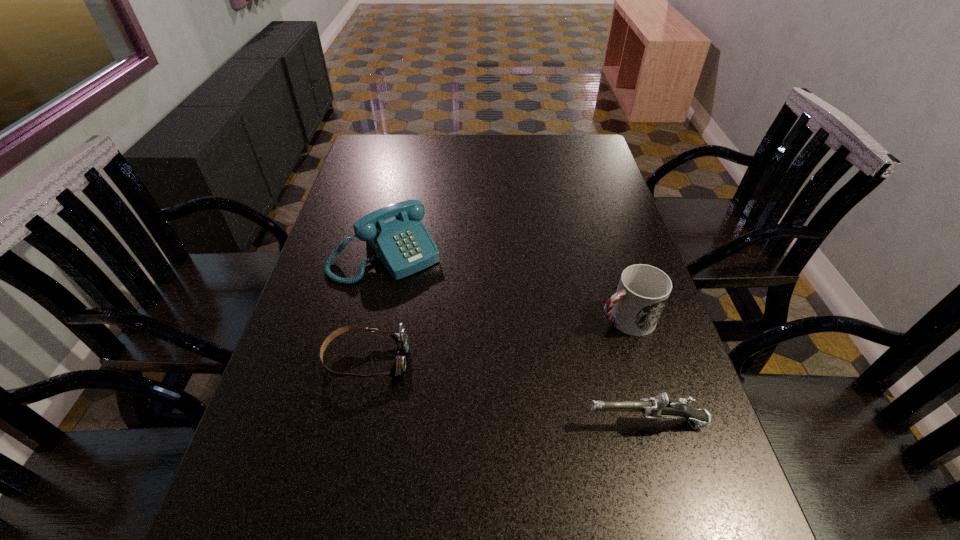
The image size is (960, 540). In the image, there is a desktop. Find the location of `free space at the near edge`. free space at the near edge is located at coordinates (606, 501).

Identify the location of free space at the left edge of the desktop. (282, 437).

Where is `vacant space at the right edge of the desktop`? This screenshot has width=960, height=540. vacant space at the right edge of the desktop is located at coordinates (564, 180).

In the image, there is a desktop. Where is `free region at the far left corner`? This screenshot has height=540, width=960. free region at the far left corner is located at coordinates (378, 164).

Identify the location of blank space at the near left corner of the desktop. The image size is (960, 540). (237, 484).

Find the location of a particular element. empty space that is in between the telephone and the gun is located at coordinates (516, 338).

Locate an element on the screen. The width and height of the screenshot is (960, 540). free area in between the cup and the shortest object is located at coordinates (495, 339).

Identify the location of vacant area between the nearest object and the cup. (636, 370).

At what (x,y) coordinates should I click in order to perform the action: click on free spot between the nearest object and the shortest object. Please return your answer as a coordinate pair (x, y). This screenshot has height=540, width=960. Looking at the image, I should click on (506, 391).

Locate an element on the screen. The image size is (960, 540). empty space between the cup and the farthest object is located at coordinates (505, 286).